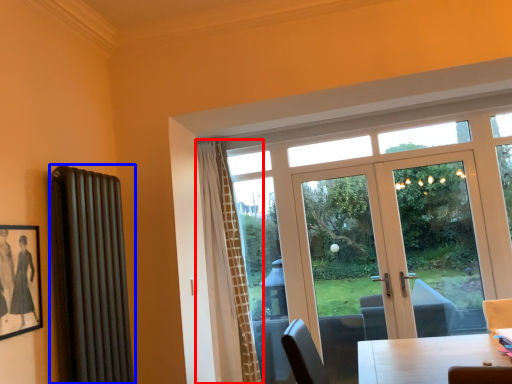
Question: Which of the following is the closest to the observer, curtain (highlighted by a red box) or radiator (highlighted by a blue box)?

Choices:
 (A) curtain
 (B) radiator

Answer: (B)